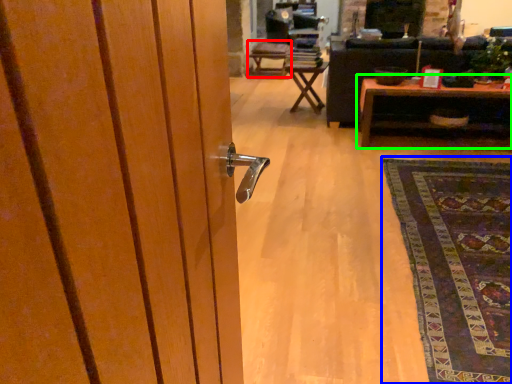
Question: Which object is positioned farthest from chair (highlighted by a red box)? Select from mat (highlighted by a blue box) and table (highlighted by a green box).

Choices:
 (A) mat
 (B) table

Answer: (A)